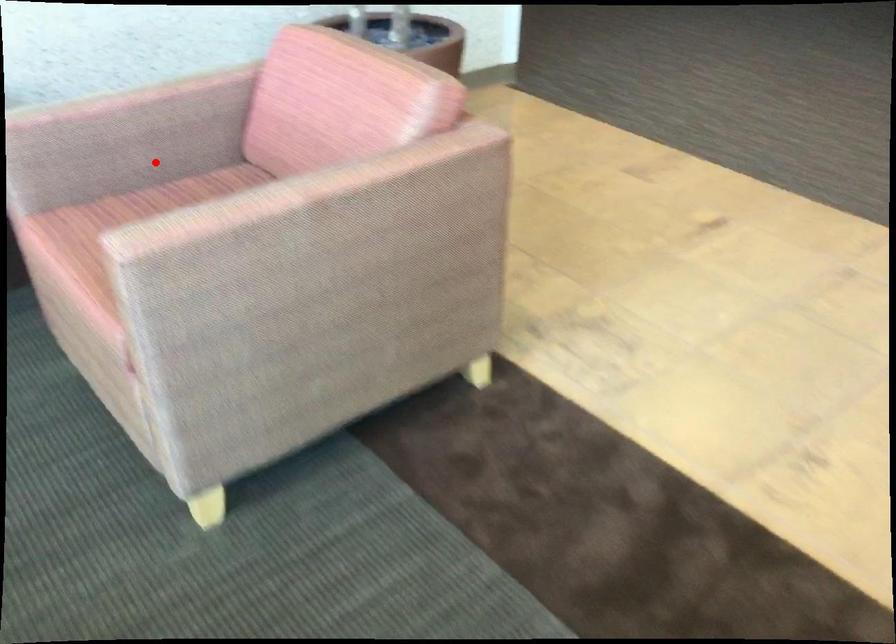
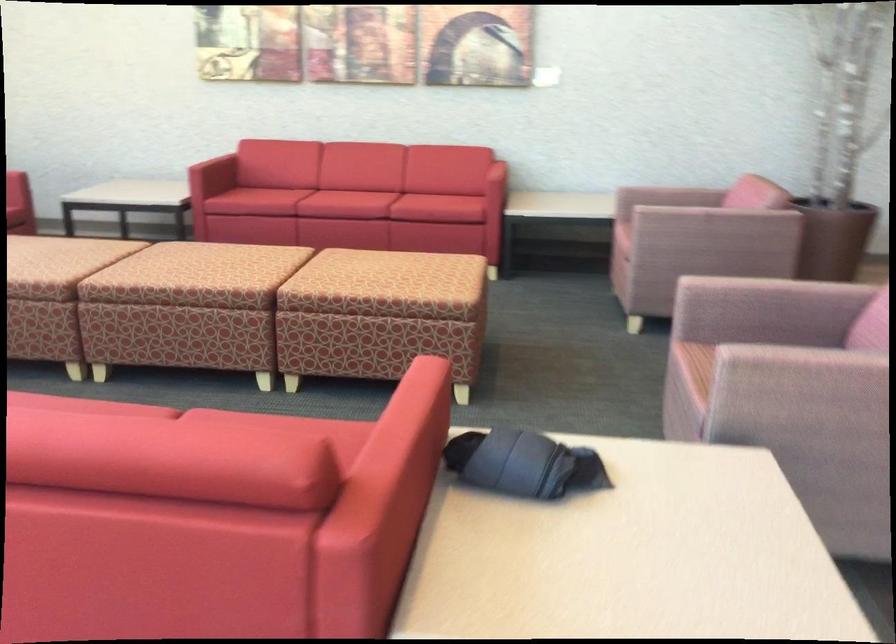
Question: I am providing you with two images of the same scene from different viewpoints. In image1, a red point is highlighted. Considering the same 3D point in image2, which of the following is correct?

Choices:
 (A) It is closer
 (B) It is farther

Answer: (B)